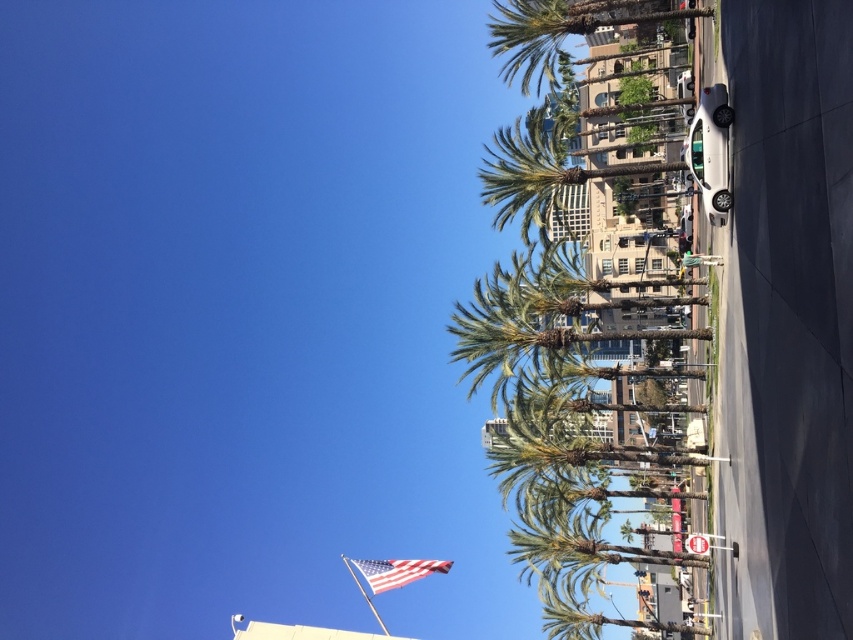
Is green leafy palm tree at center further to camera compared to american flag at center?

Yes, green leafy palm tree at center is further from the viewer.

Who is lower down, green leafy palm tree at center or american flag at center?

american flag at center

Describe the element at coordinates (540, 172) in the screenshot. I see `green leafy palm tree at center` at that location.

This screenshot has width=853, height=640. I want to click on green leafy palm tree at center, so click(540, 172).

Consider the image. Does green leafy palm tree at upper center have a greater width compared to american flag at center?

Correct, the width of green leafy palm tree at upper center exceeds that of american flag at center.

This screenshot has width=853, height=640. Identify the location of green leafy palm tree at upper center. (561, 29).

Where is `green leafy palm tree at upper center`? green leafy palm tree at upper center is located at coordinates (561, 29).

Locate an element on the screen. This screenshot has width=853, height=640. green leafy palm tree at center is located at coordinates (540, 172).

Is point (502, 145) closer to viewer compared to point (567, 6)?

That is True.

The image size is (853, 640). What are the coordinates of `green leafy palm tree at center` in the screenshot? It's located at (540, 172).